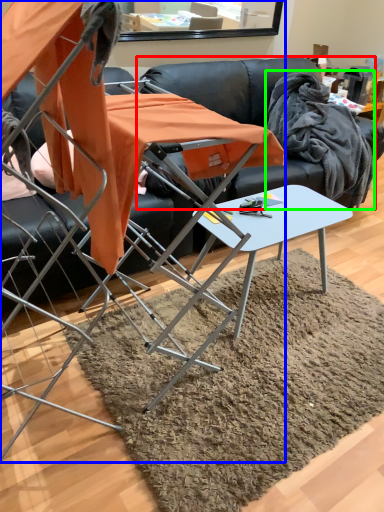
Question: Which object is positioned closest to couch (highlighted by a red box)? Select from chair (highlighted by a blue box) and fabric (highlighted by a green box).

Choices:
 (A) chair
 (B) fabric

Answer: (B)